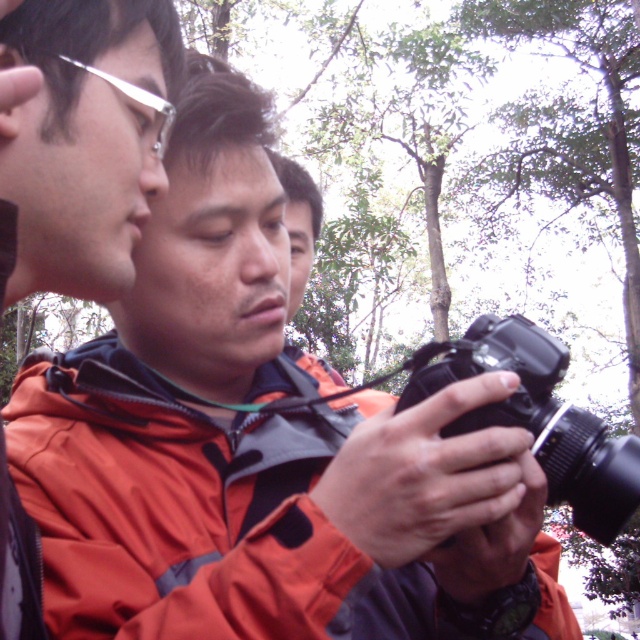
Locate an element on the screen. orange fabric jacket at center is located at coordinates (218, 520).

Who is higher up, orange fabric jacket at center or matte orange jacket at left?

matte orange jacket at left is above.

Is point (88, 609) farther from viewer compared to point (29, 531)?

That is False.

Where is `orange fabric jacket at center`? The image size is (640, 640). orange fabric jacket at center is located at coordinates (218, 520).

Between matte orange jacket at left and silver metallic glasses at upper left, which one appears on the right side from the viewer's perspective?

silver metallic glasses at upper left

Does matte orange jacket at left have a larger size compared to silver metallic glasses at upper left?

Correct, matte orange jacket at left is larger in size than silver metallic glasses at upper left.

Image resolution: width=640 pixels, height=640 pixels. What are the coordinates of `matte orange jacket at left` in the screenshot? It's located at (81, 140).

In order to click on matte orange jacket at left in this screenshot , I will do `click(81, 140)`.

Is matte orange jacket at left thinner than black plastic camera at center?

Yes.

Who is more forward, [102,1] or [515,394]?

Point [515,394]

Locate an element on the screen. matte orange jacket at left is located at coordinates (81, 140).